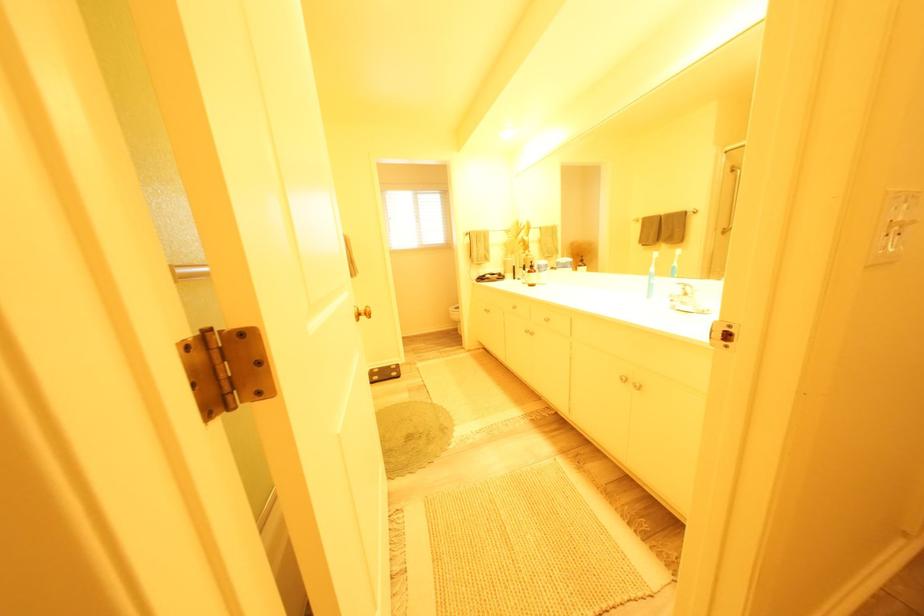
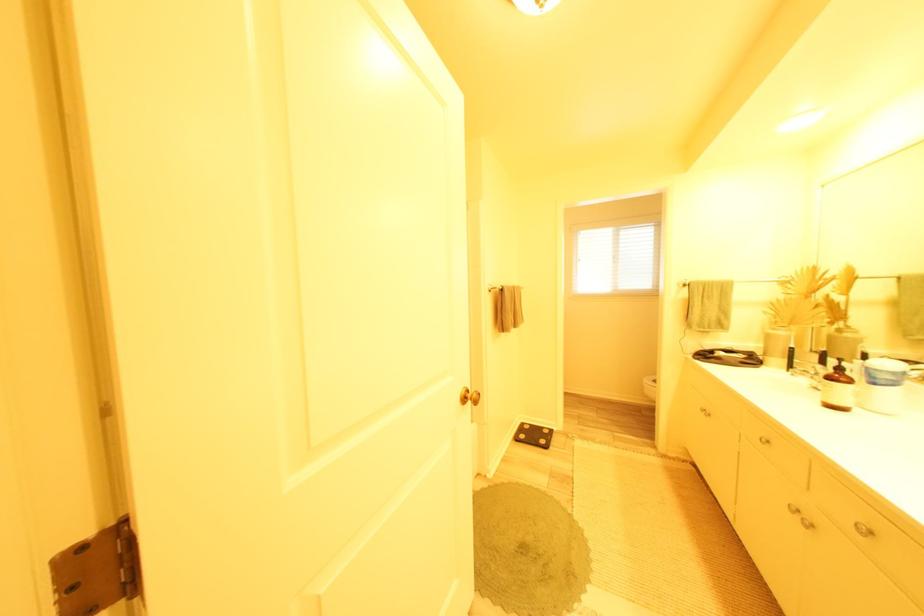
Locate, in the second image, the point that corresponds to point (524, 275) in the first image.

(796, 362)